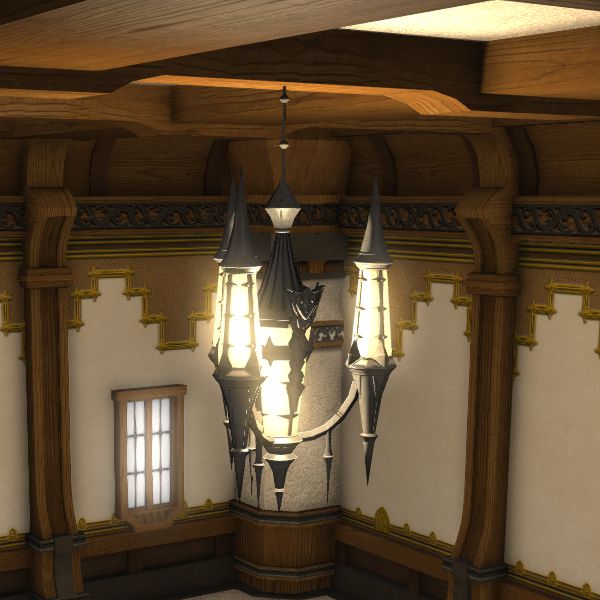
Where is `wood frame`? This screenshot has width=600, height=600. wood frame is located at coordinates (48, 400), (481, 417).